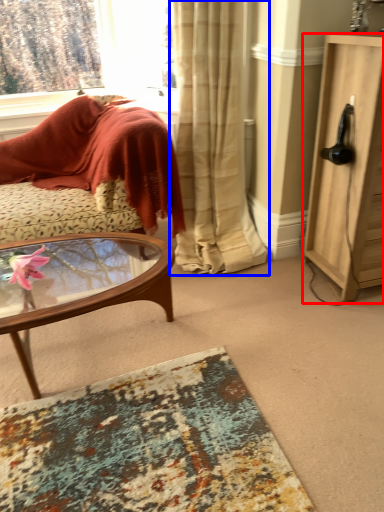
Question: Which object appears farthest to the camera in this image, cabinetry (highlighted by a red box) or curtain (highlighted by a blue box)?

Choices:
 (A) cabinetry
 (B) curtain

Answer: (B)